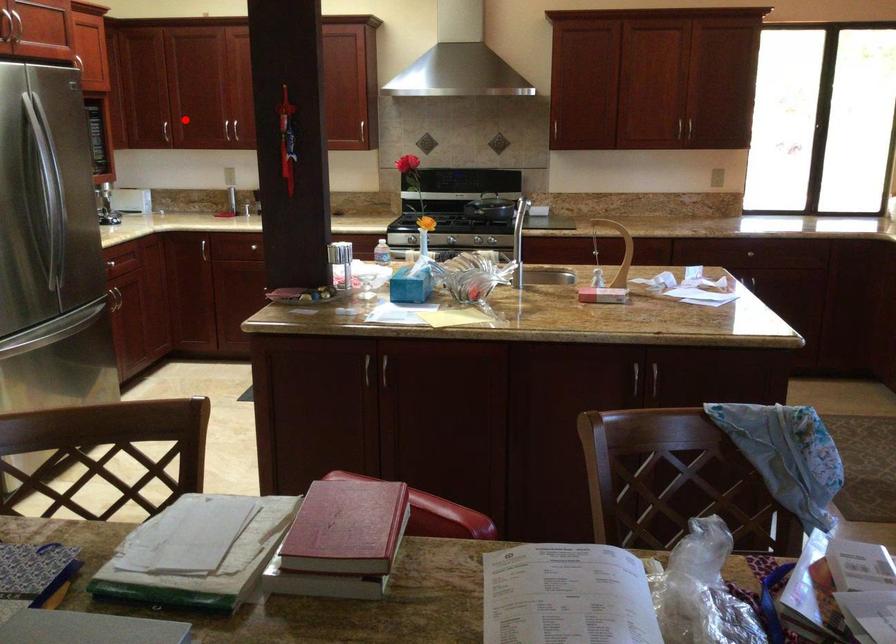
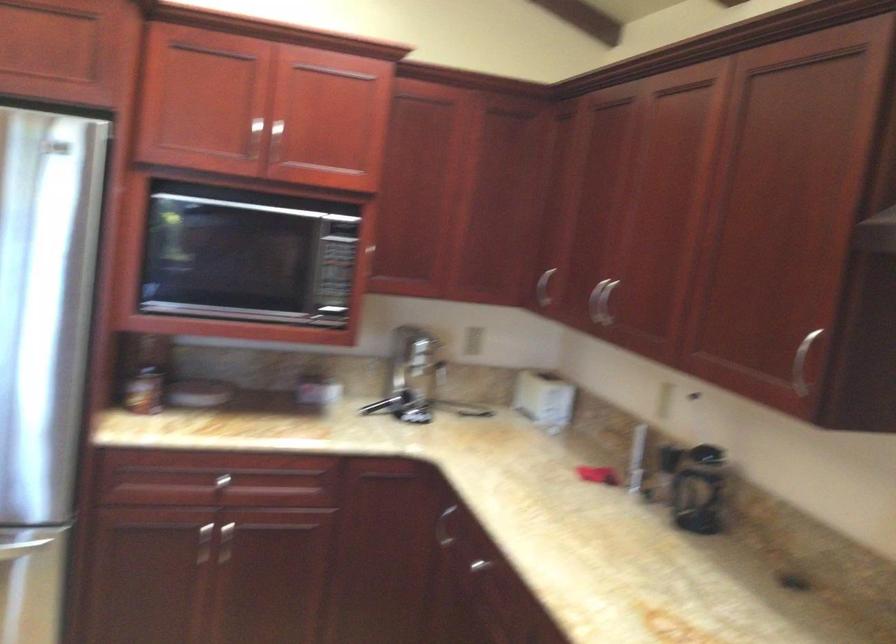
Question: I am providing you with two images of the same scene from different viewpoints. A red point is marked on the first image. Can you still see the location of the red point in image 2?

Choices:
 (A) Yes
 (B) No

Answer: (A)